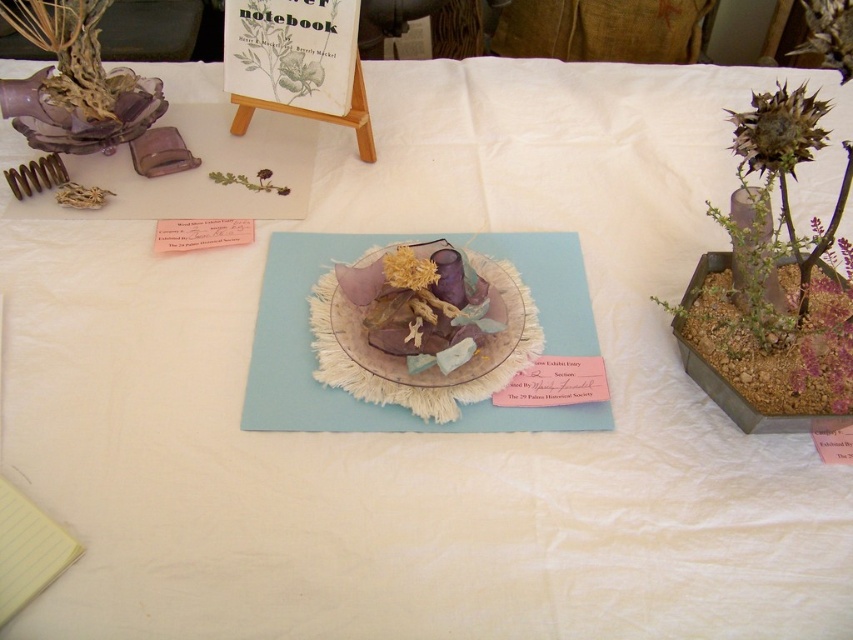
Is point (408, 248) positioned before point (213, 180)?

Yes.

Which is above, fuzzy golden flower at center or green matte plant at center?

Positioned higher is green matte plant at center.

Which is behind, point (389, 282) or point (239, 179)?

The point (239, 179) is behind.

Locate an element on the screen. The height and width of the screenshot is (640, 853). fuzzy golden flower at center is located at coordinates (408, 269).

Is brown textured flower at upper right smaller than fuzzy golden flower at center?

No.

Locate an element on the screen. Image resolution: width=853 pixels, height=640 pixels. brown textured flower at upper right is located at coordinates (778, 129).

Locate an element on the screen. This screenshot has width=853, height=640. brown textured flower at upper right is located at coordinates (778, 129).

Which of these two, brown textured flower at upper right or green matte plant at center, stands taller?

brown textured flower at upper right is taller.

Can you confirm if brown textured flower at upper right is positioned to the right of green matte plant at center?

Correct, you'll find brown textured flower at upper right to the right of green matte plant at center.

Is point (796, 104) closer to viewer compared to point (259, 179)?

Yes.

Where is `brown textured flower at upper right`? brown textured flower at upper right is located at coordinates (778, 129).